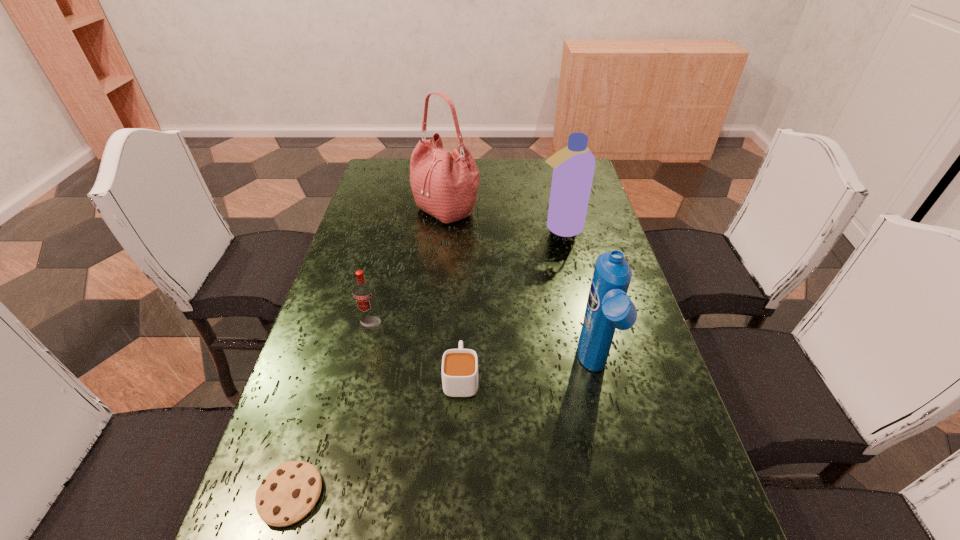
At what (x,y) coordinates should I click in order to perform the action: click on the tallest object. Please return your answer as a coordinate pair (x, y). Looking at the image, I should click on (444, 184).

The image size is (960, 540). In order to click on the farther shampoo in this screenshot , I will do point(573,166).

In order to click on the nearer shampoo in this screenshot , I will do `click(608, 307)`.

The width and height of the screenshot is (960, 540). What are the coordinates of `vodka` in the screenshot? It's located at (363, 291).

Locate an element on the screen. The height and width of the screenshot is (540, 960). the fourth nearest object is located at coordinates (363, 291).

Locate an element on the screen. cup is located at coordinates (459, 370).

Find the location of a particular element. This screenshot has height=540, width=960. cookie is located at coordinates (289, 492).

Where is `the shortest object`? the shortest object is located at coordinates pyautogui.click(x=289, y=492).

Locate an element on the screen. free location located on the right of the tallest object is located at coordinates (536, 209).

You are a GUI agent. You are given a task and a screenshot of the screen. Output one action in this format:
    pyautogui.click(x=<x>, y=<y>)
    Task: Click on the vacant space situated on the left of the farther shampoo
    
    Given the screenshot: What is the action you would take?
    pyautogui.click(x=500, y=228)